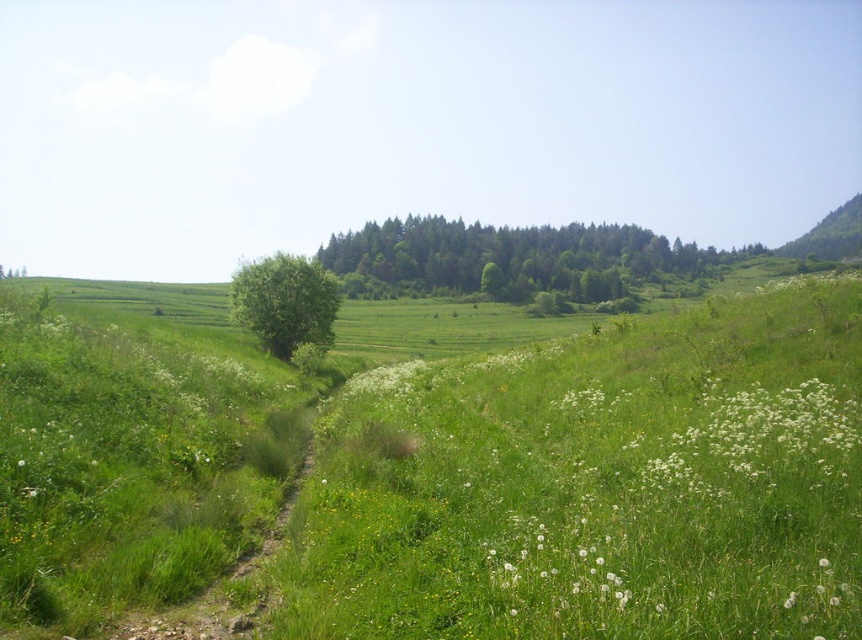
Question: Which of the following is the closest to the observer?

Choices:
 (A) white fluffy flowers at lower right
 (B) green grassy hillside at upper right
 (C) green leafy tree at center

Answer: (A)

Question: Which point is farther to the camera?

Choices:
 (A) (696, 545)
 (B) (859, 209)
 (C) (373, 273)

Answer: (B)

Question: Which of these objects is positioned farthest from the green grass at center?

Choices:
 (A) green leafy tree at center
 (B) white fluffy flowers at lower right
 (C) green leafy forest at center
 (D) white fluffy flower at lower right

Answer: (C)

Question: Can you confirm if green leafy tree at center is positioned to the left of green grassy hillside at upper right?

Choices:
 (A) yes
 (B) no

Answer: (A)

Question: Can you confirm if green leafy forest at center is positioned to the left of green grassy hillside at upper right?

Choices:
 (A) yes
 (B) no

Answer: (A)

Question: Can you confirm if green leafy forest at center is positioned to the left of green leafy tree at center?

Choices:
 (A) no
 (B) yes

Answer: (A)